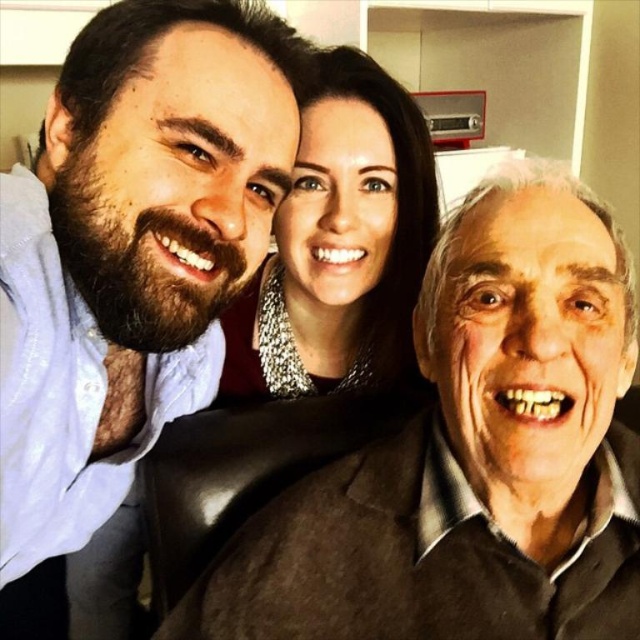
Question: Which point appears closest to the camera in this image?

Choices:
 (A) (616, 337)
 (B) (109, 56)

Answer: (A)

Question: Does matte black jacket at center have a lesser width compared to matte blue shirt at left?

Choices:
 (A) yes
 (B) no

Answer: (B)

Question: Among these points, which one is farthest from the camera?

Choices:
 (A) (376, 387)
 (B) (19, 212)
 (C) (582, 324)

Answer: (A)

Question: Can you confirm if matte black jacket at center is thinner than silver metallic necklace at upper center?

Choices:
 (A) no
 (B) yes

Answer: (A)

Question: Is matte black jacket at center smaller than matte blue shirt at left?

Choices:
 (A) no
 (B) yes

Answer: (B)

Question: Which object is positioned closest to the matte blue shirt at left?

Choices:
 (A) silver metallic necklace at upper center
 (B) matte black jacket at center

Answer: (A)